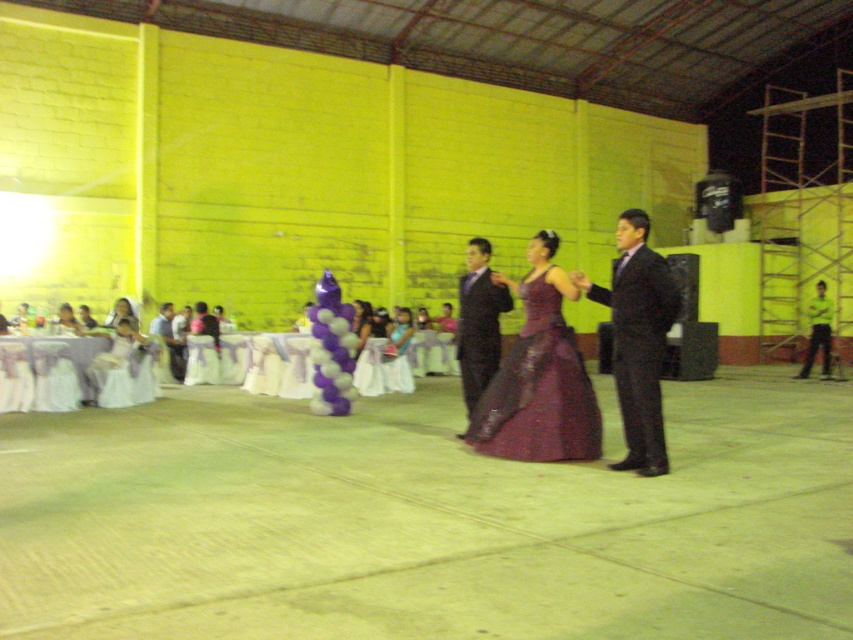
Question: Which of the following is the farthest from the observer?

Choices:
 (A) matte black suit at center
 (B) satin burgundy dress at center
 (C) matte purple dress at center

Answer: (C)

Question: Estimate the real-world distances between objects in this image. Which object is closer to the satin purple dress at center?

Choices:
 (A) matte black suit at left
 (B) shiny purple gown at center

Answer: (A)

Question: Does green fabric pants at center appear over satin purple dress at center?

Choices:
 (A) no
 (B) yes

Answer: (A)

Question: Which of the following is the closest to the observer?

Choices:
 (A) (817, 301)
 (B) (561, 333)
 (C) (579, 364)

Answer: (B)

Question: Does matte black suit at center have a greater width compared to matte white dress at lower left?

Choices:
 (A) no
 (B) yes

Answer: (A)

Question: Is shiny purple gown at center behind green fabric pants at center?

Choices:
 (A) no
 (B) yes

Answer: (A)